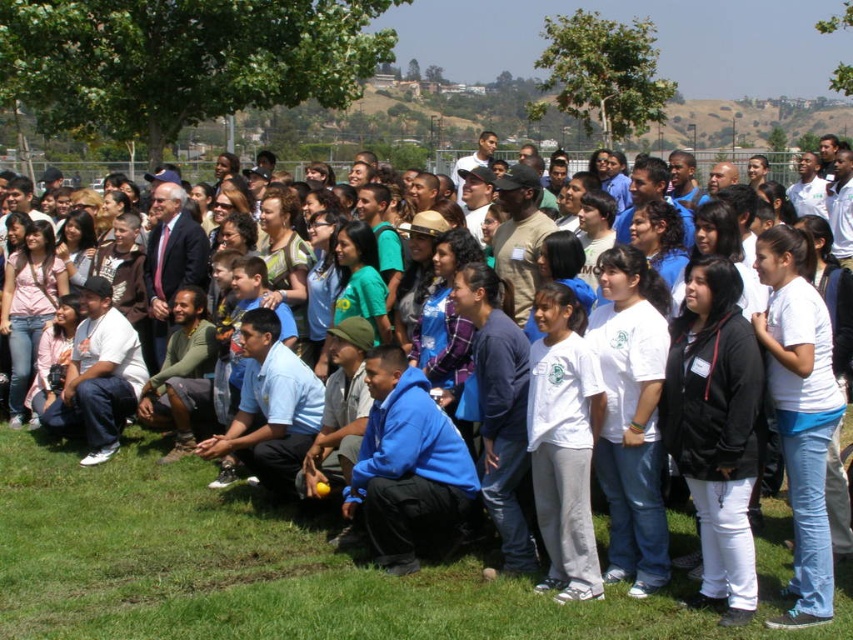
Does green grass at lower left appear on the right side of white matte t-shirt at center?

No, green grass at lower left is not to the right of white matte t-shirt at center.

Is green grass at lower left taller than white matte t-shirt at center?

No.

Is point (503, 636) behind point (560, 356)?

No, it is in front of (560, 356).

The width and height of the screenshot is (853, 640). I want to click on green grass at lower left, so click(270, 568).